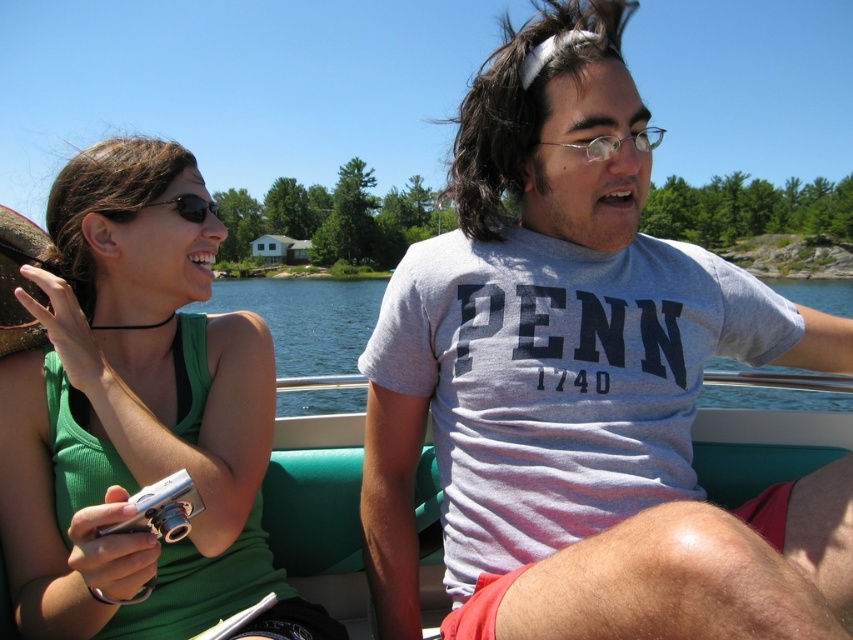
Who is positioned more to the left, green matte tank top at upper left or teal fabric boat at center?

From the viewer's perspective, green matte tank top at upper left appears more on the left side.

Measure the distance between green matte tank top at upper left and camera.

3.85 feet

Who is more forward, [68,563] or [277,388]?

Point [68,563] is more forward.

What are the coordinates of `green matte tank top at upper left` in the screenshot? It's located at (137, 417).

Looking at this image, does green matte tank top at upper left have a lesser width compared to black reflective sunglasses at upper left?

Yes, green matte tank top at upper left is thinner than black reflective sunglasses at upper left.

Which is below, green matte tank top at upper left or black reflective sunglasses at upper left?

green matte tank top at upper left is lower down.

Find the location of a particular element. The width and height of the screenshot is (853, 640). green matte tank top at upper left is located at coordinates (137, 417).

Is gray cotton t-shirt at center to the left of black reflective sunglasses at upper left from the viewer's perspective?

In fact, gray cotton t-shirt at center is to the right of black reflective sunglasses at upper left.

Is gray cotton t-shirt at center taller than black reflective sunglasses at upper left?

Correct, gray cotton t-shirt at center is much taller as black reflective sunglasses at upper left.

Between point (761, 513) and point (189, 196), which one is positioned in front?

Point (761, 513)

Find the location of a particular element. This screenshot has height=640, width=853. gray cotton t-shirt at center is located at coordinates (583, 385).